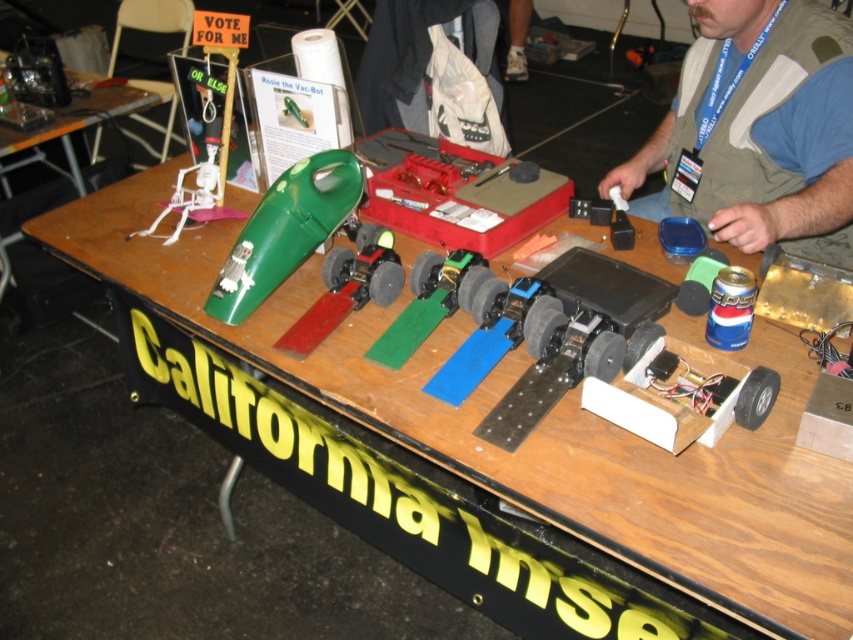
Question: Which point is closer to the camera taking this photo?

Choices:
 (A) (846, 45)
 (B) (175, 208)

Answer: (A)

Question: Estimate the real-world distances between objects in this image. Which object is closer to the white plastic skeleton at upper left?

Choices:
 (A) green matte vacuum cleaner at center
 (B) brown fabric vest at upper right

Answer: (A)

Question: Which point appears farthest from the camera in this image?

Choices:
 (A) (770, 221)
 (B) (341, 156)
 (C) (218, 179)

Answer: (C)

Question: Does brown fabric vest at upper right come behind green matte vacuum cleaner at center?

Choices:
 (A) no
 (B) yes

Answer: (B)

Question: Considering the relative positions of brown fabric vest at upper right and white plastic skeleton at upper left in the image provided, where is brown fabric vest at upper right located with respect to white plastic skeleton at upper left?

Choices:
 (A) right
 (B) left

Answer: (A)

Question: Is brown fabric vest at upper right wider than green matte vacuum cleaner at center?

Choices:
 (A) no
 (B) yes

Answer: (B)